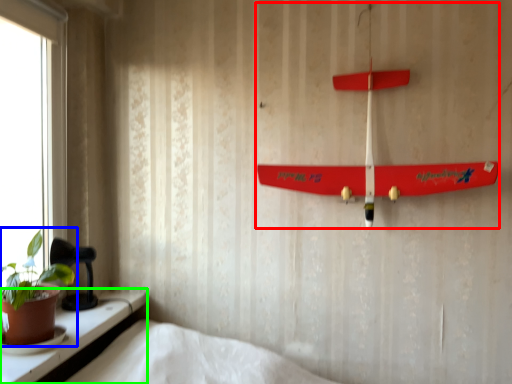
Question: Which is farther away from toy (highlighted by a red box)? houseplant (highlighted by a blue box) or window (highlighted by a green box)?

Choices:
 (A) houseplant
 (B) window

Answer: (A)